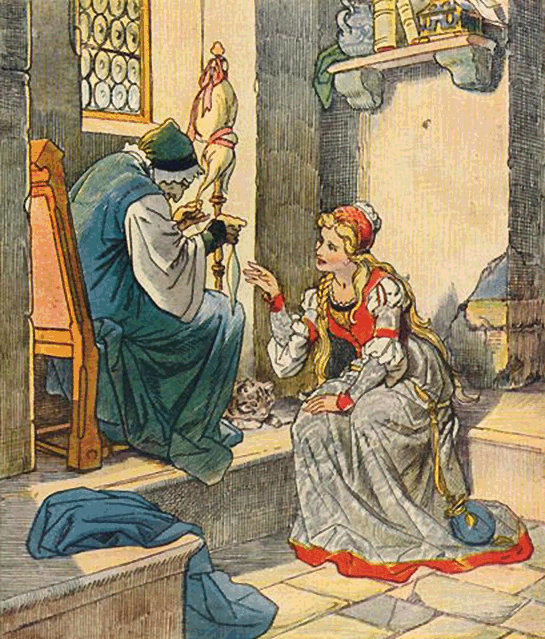
You are a GUI agent. You are given a task and a screenshot of the screen. Output one action in this format:
    pyautogui.click(x=<x>, y=<y>)
    Task: Click on the shelf
    The width and height of the screenshot is (545, 639).
    Given the screenshot: What is the action you would take?
    pyautogui.click(x=362, y=62)